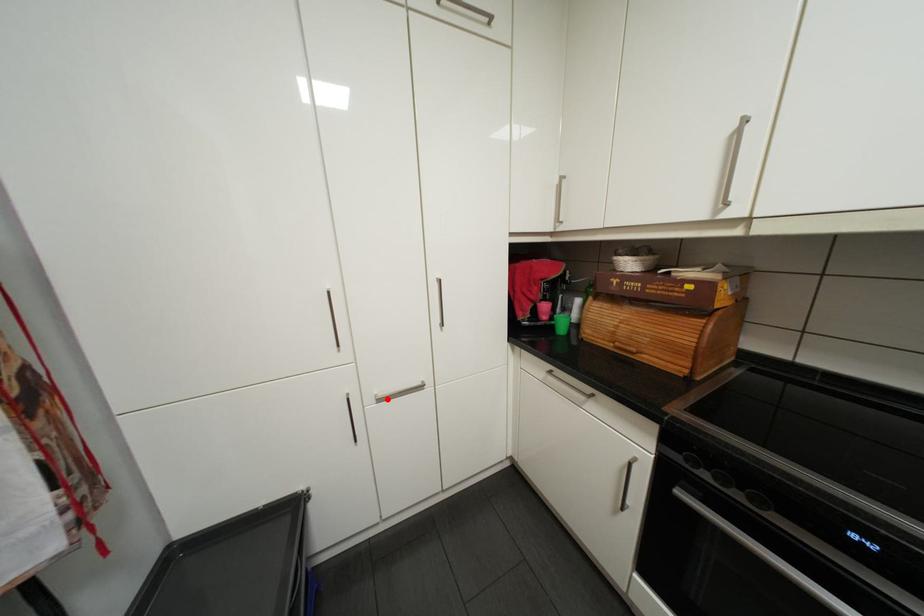
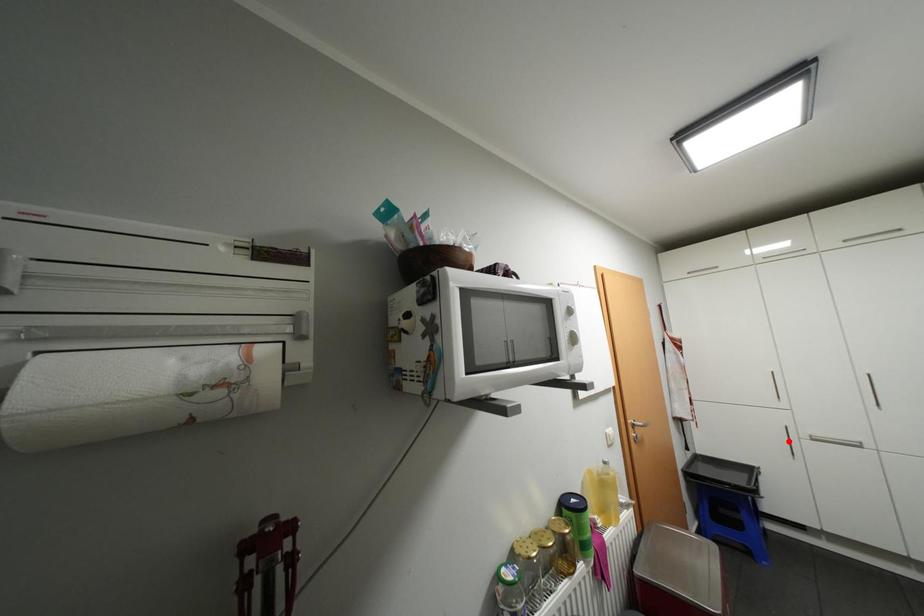
I am providing you with two images of the same scene from different viewpoints. A red point is marked on the first image and another point is marked on the second image. Is the marked point in image1 the same physical position as the marked point in image2?

No